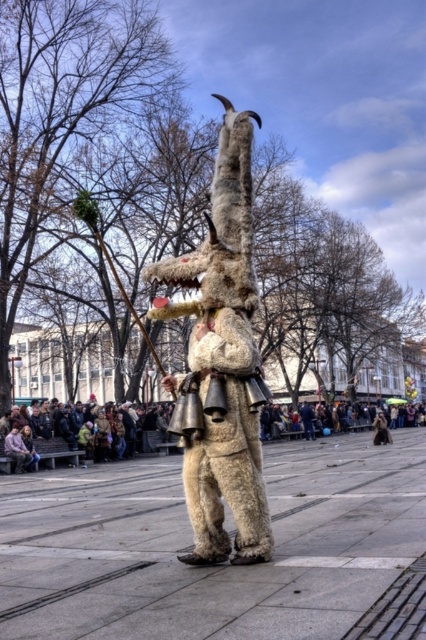
Question: Which of the following is the farthest from the observer?

Choices:
 (A) (232, 428)
 (B) (2, 467)
 (C) (206, 328)

Answer: (B)

Question: Observing the image, what is the correct spatial positioning of furry beige creature at center in reference to brown fabric crowd at lower left?

Choices:
 (A) below
 (B) above

Answer: (B)

Question: Can you confirm if smooth concrete pavement at center is bigger than brown fabric crowd at lower left?

Choices:
 (A) no
 (B) yes

Answer: (B)

Question: Which point is farther to the camera?

Choices:
 (A) smooth concrete pavement at center
 (B) furry beige creature at center

Answer: (B)

Question: Which point is closer to the camera?

Choices:
 (A) furry beige costume at center
 (B) dark brown leather jacket at lower center

Answer: (A)

Question: Is smooth concrete pavement at center wider than furry beige creature at center?

Choices:
 (A) yes
 (B) no

Answer: (A)